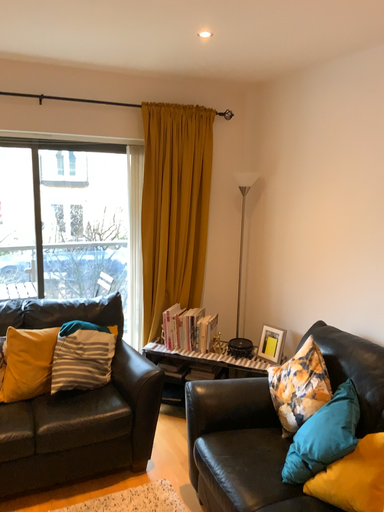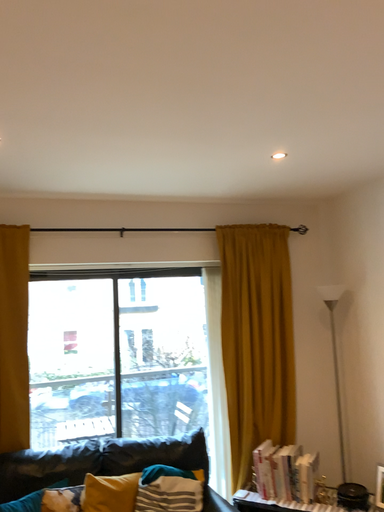
Question: Which way did the camera rotate in the video?

Choices:
 (A) rotated right
 (B) rotated left

Answer: (B)